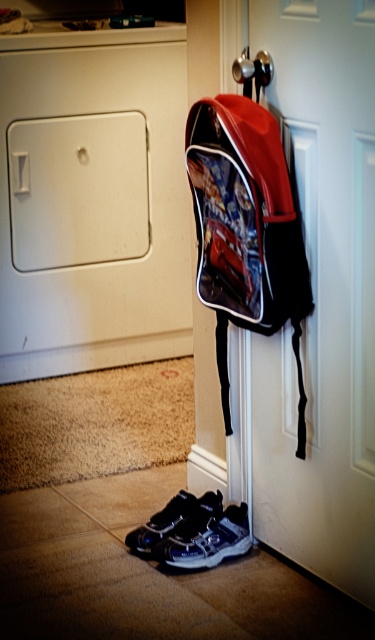
You are standing in the room and want to place a small plant pot between the two points, point (277, 145) and point (138, 540). Which point should the pot be closer to so it is in front of the other point?

The pot should be closer to point (277, 145) because it is in front of point (138, 540).

You are standing in front of the white matte door at center. You need to place a package that is 0.5 meters wide on the floor next to the door. Is there enough space between the door and the nearest object to the right of it?

The white matte door at center is located at point (x=322, y=298). However, without specific spatial relationships or distances provided in the Objects Description, it is impossible to determine if there is sufficient space. Please provide more details about the positioning of nearby objects relative to the door.

You are trying to hang a new picture frame on the wall next to the white matte door at center. The frame is as wide as the shiny red backpack at door. Will the door fit horizontally next to the backpack?

The white matte door at center is narrower than the shiny red backpack at door, so the door cannot fit horizontally next to the backpack since it is narrower.